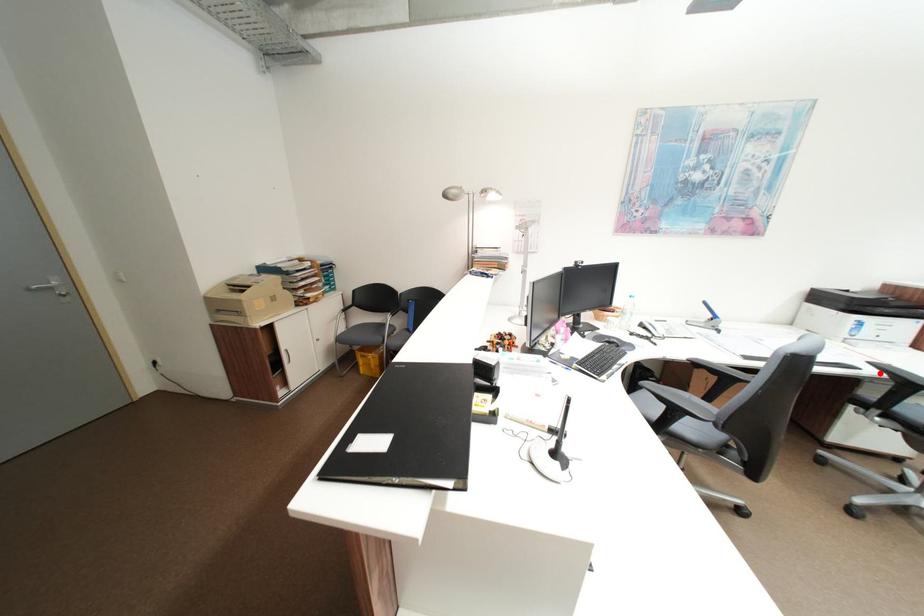
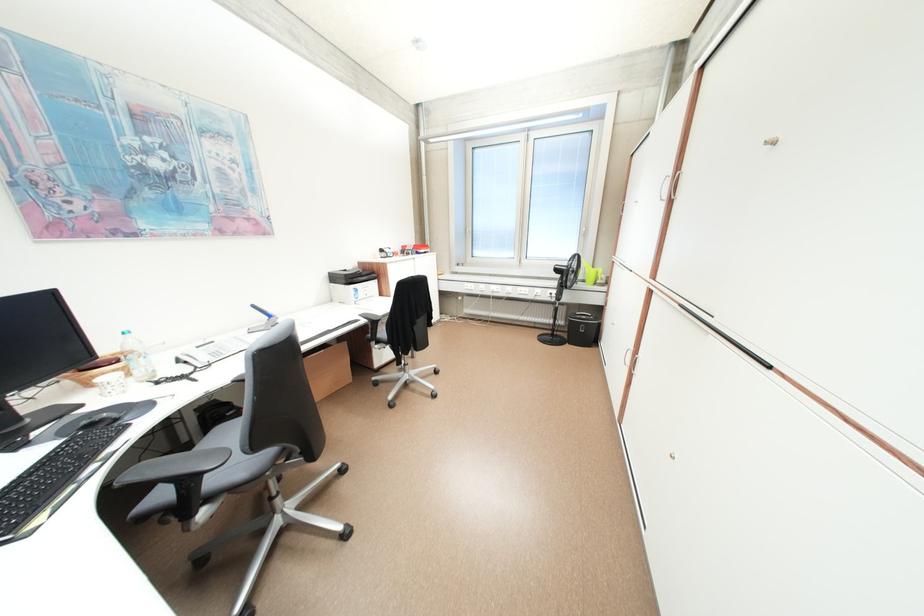
Locate, in the second image, the point that corresponds to the highlighted location in the first image.

(371, 322)